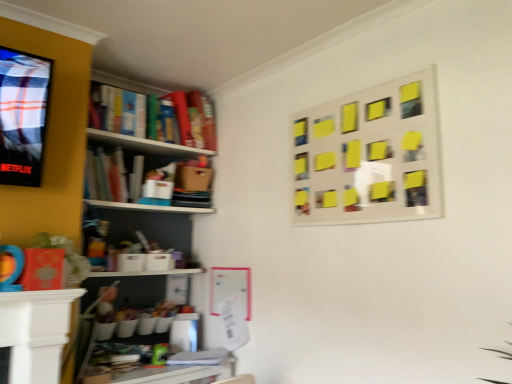
Question: Which direction should I rotate to look at wooden desk at lower center, the 1th table viewed from the back?

Choices:
 (A) left
 (B) right

Answer: (A)

Question: Does yellow sticky notes at upper right have a larger size compared to white glossy table at lower left, acting as the 2th table starting from the bottom?

Choices:
 (A) no
 (B) yes

Answer: (B)

Question: From the image's perspective, is yellow sticky notes at upper right under white glossy table at lower left, acting as the 1th table starting from the front?

Choices:
 (A) no
 (B) yes

Answer: (A)

Question: Are yellow sticky notes at upper right and white glossy table at lower left, which ranks as the second table in back-to-front order, located far from each other?

Choices:
 (A) no
 (B) yes

Answer: (B)

Question: Is the surface of yellow sticky notes at upper right in direct contact with white glossy table at lower left, acting as the 2th table starting from the bottom?

Choices:
 (A) no
 (B) yes

Answer: (A)

Question: Does yellow sticky notes at upper right have a greater width compared to white glossy table at lower left, acting as the 2th table starting from the bottom?

Choices:
 (A) yes
 (B) no

Answer: (B)

Question: Considering the relative sizes of yellow sticky notes at upper right and white glossy table at lower left, acting as the 2th table starting from the bottom, in the image provided, is yellow sticky notes at upper right taller than white glossy table at lower left, acting as the 2th table starting from the bottom,?

Choices:
 (A) no
 (B) yes

Answer: (B)

Question: Is white glossy table at lower left, acting as the 1th table starting from the front, further to the viewer compared to wooden desk at lower center, placed as the 2th table when sorted from top to bottom?

Choices:
 (A) yes
 (B) no

Answer: (B)

Question: Considering the relative sizes of white glossy table at lower left, acting as the 1th table starting from the front, and wooden desk at lower center, placed as the 2th table when sorted from top to bottom, in the image provided, is white glossy table at lower left, acting as the 1th table starting from the front, thinner than wooden desk at lower center, placed as the 2th table when sorted from top to bottom,?

Choices:
 (A) yes
 (B) no

Answer: (A)

Question: Is white glossy table at lower left, which ranks as the second table in back-to-front order, beside wooden desk at lower center, the 1th table viewed from the back?

Choices:
 (A) yes
 (B) no

Answer: (B)

Question: Could you tell me if white glossy table at lower left, which ranks as the first table in top-to-bottom order, is turned towards wooden desk at lower center, the 1th table viewed from the back?

Choices:
 (A) no
 (B) yes

Answer: (A)

Question: Can you confirm if white glossy table at lower left, acting as the 2th table starting from the bottom, is bigger than wooden desk at lower center, the 1th table viewed from the back?

Choices:
 (A) yes
 (B) no

Answer: (B)

Question: Considering the relative sizes of white glossy table at lower left, acting as the 1th table starting from the front, and wooden desk at lower center, the 1th table viewed from the back, in the image provided, is white glossy table at lower left, acting as the 1th table starting from the front, shorter than wooden desk at lower center, the 1th table viewed from the back,?

Choices:
 (A) no
 (B) yes

Answer: (A)

Question: From the image's perspective, is wooden desk at lower center, positioned as the 2th table in front-to-back order, located beneath yellow sticky notes at upper right?

Choices:
 (A) yes
 (B) no

Answer: (A)